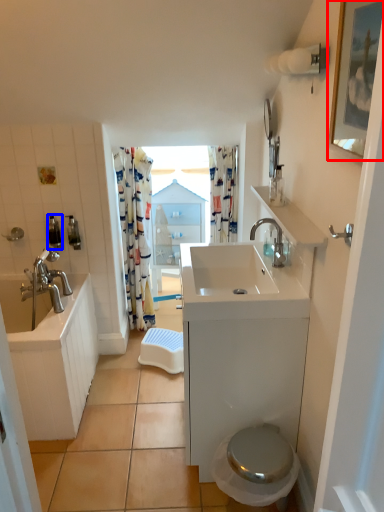
Question: Among these objects, which one is farthest to the camera, picture frame (highlighted by a red box) or toiletry (highlighted by a blue box)?

Choices:
 (A) picture frame
 (B) toiletry

Answer: (B)